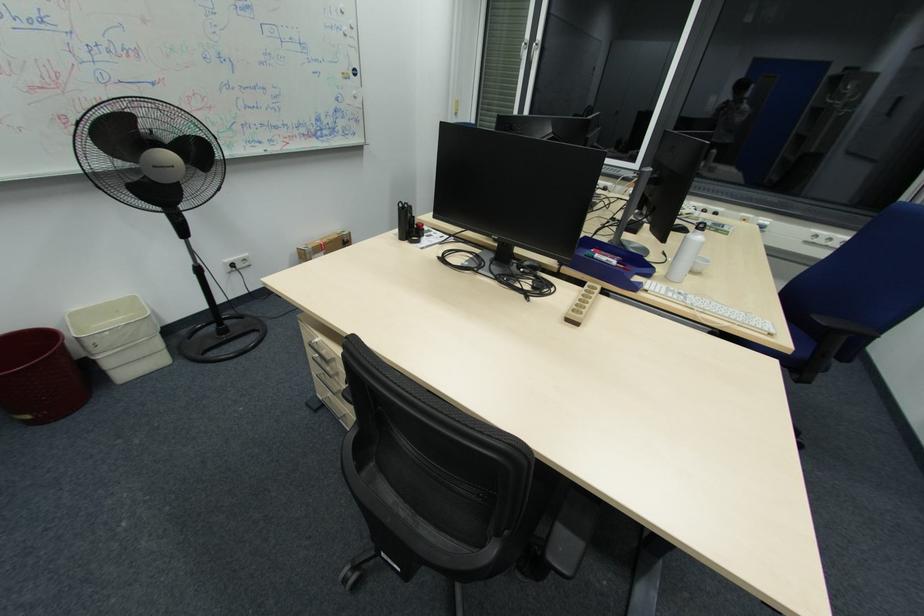
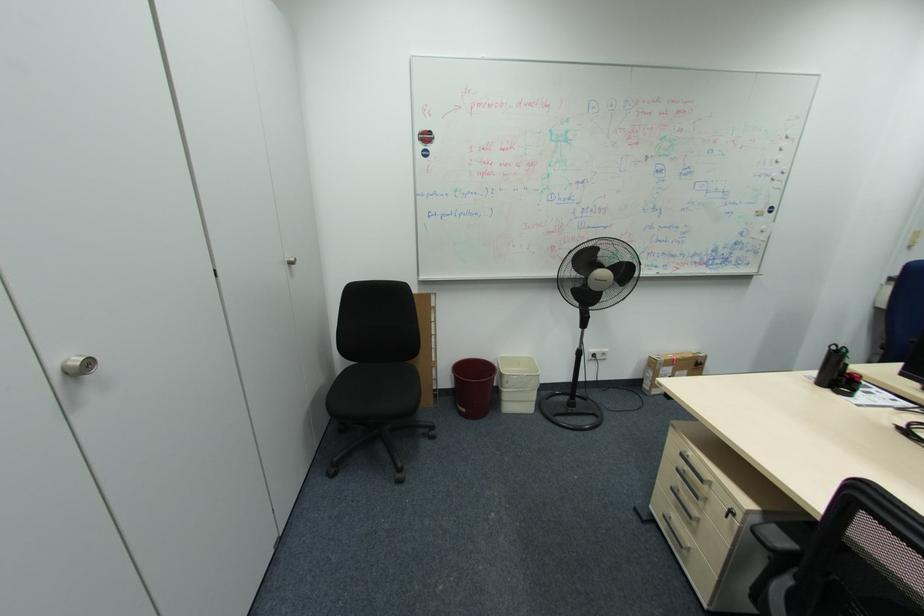
Question: How did the camera likely rotate?

Choices:
 (A) Left
 (B) Right
 (C) Up
 (D) Down

Answer: (A)